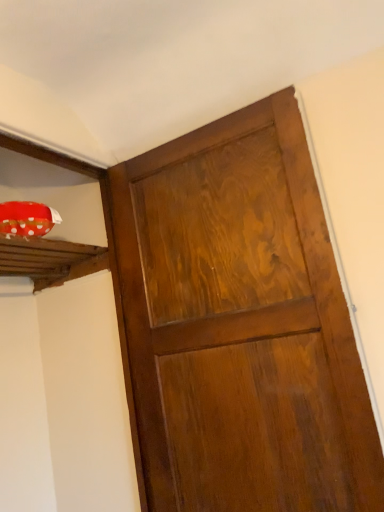
Question: Does point (28, 240) appear closer or farther from the camera than point (281, 402)?

Choices:
 (A) farther
 (B) closer

Answer: (A)

Question: Based on their positions, is wooden plank at upper left located to the left or right of glossy wood door at center?

Choices:
 (A) right
 (B) left

Answer: (B)

Question: From a real-world perspective, is wooden plank at upper left positioned above or below glossy wood door at center?

Choices:
 (A) below
 (B) above

Answer: (B)

Question: From a real-world perspective, is glossy wood door at center above or below wooden plank at upper left?

Choices:
 (A) above
 (B) below

Answer: (B)

Question: Considering the positions of glossy wood door at center and wooden plank at upper left in the image, is glossy wood door at center taller or shorter than wooden plank at upper left?

Choices:
 (A) short
 (B) tall

Answer: (B)

Question: Considering their positions, is glossy wood door at center located in front of or behind wooden plank at upper left?

Choices:
 (A) front
 (B) behind

Answer: (A)

Question: Based on their sizes in the image, would you say glossy wood door at center is bigger or smaller than wooden plank at upper left?

Choices:
 (A) big
 (B) small

Answer: (A)